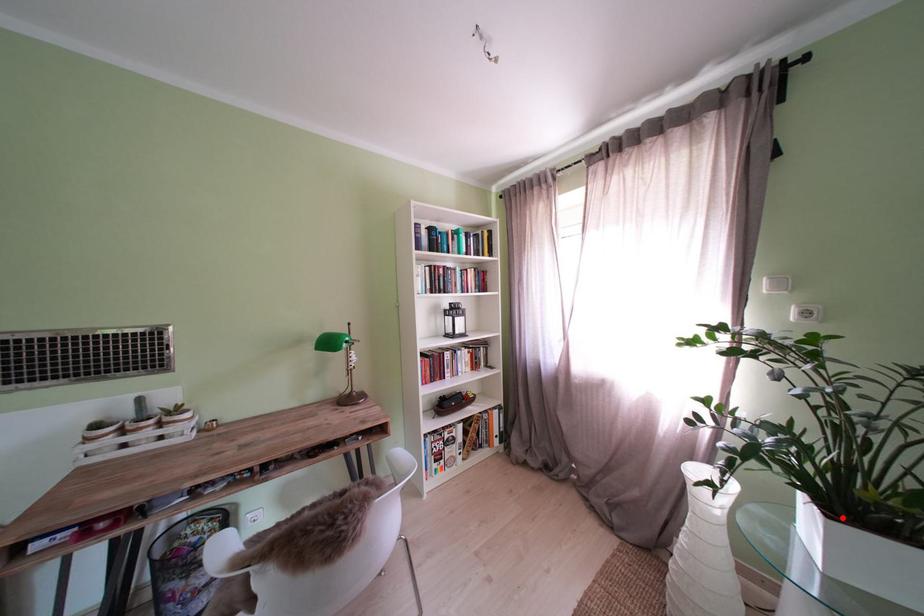
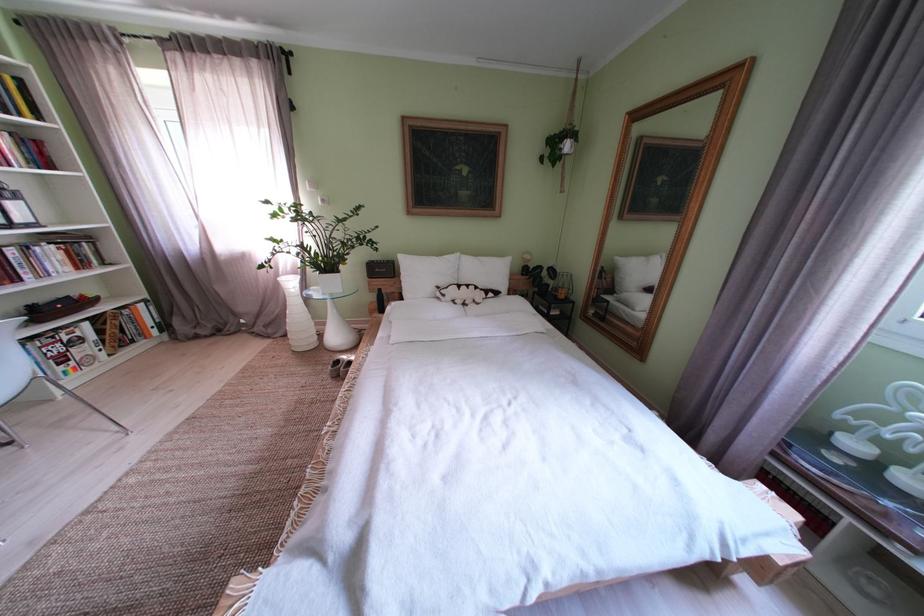
In the second image, find the point that corresponds to the highlighted location in the first image.

(333, 278)